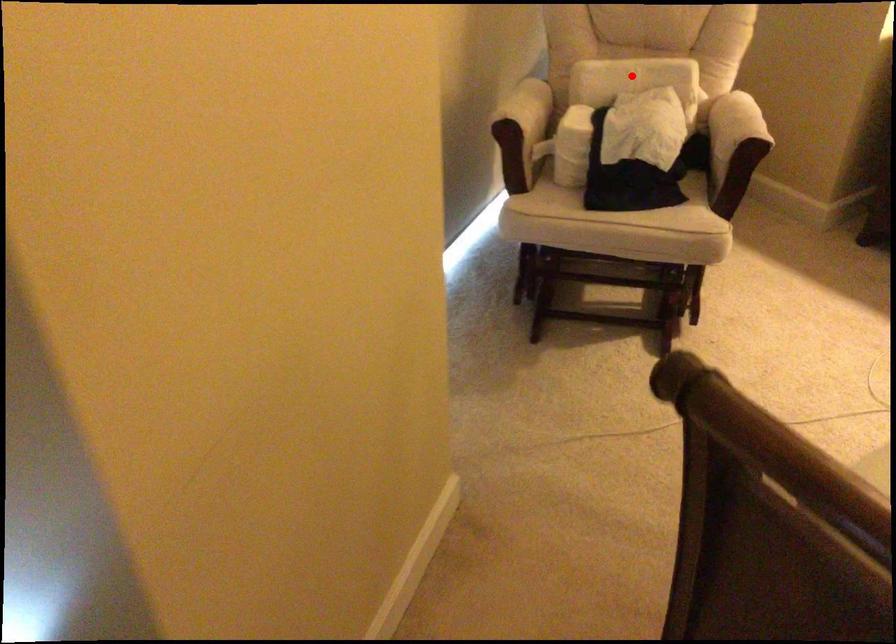
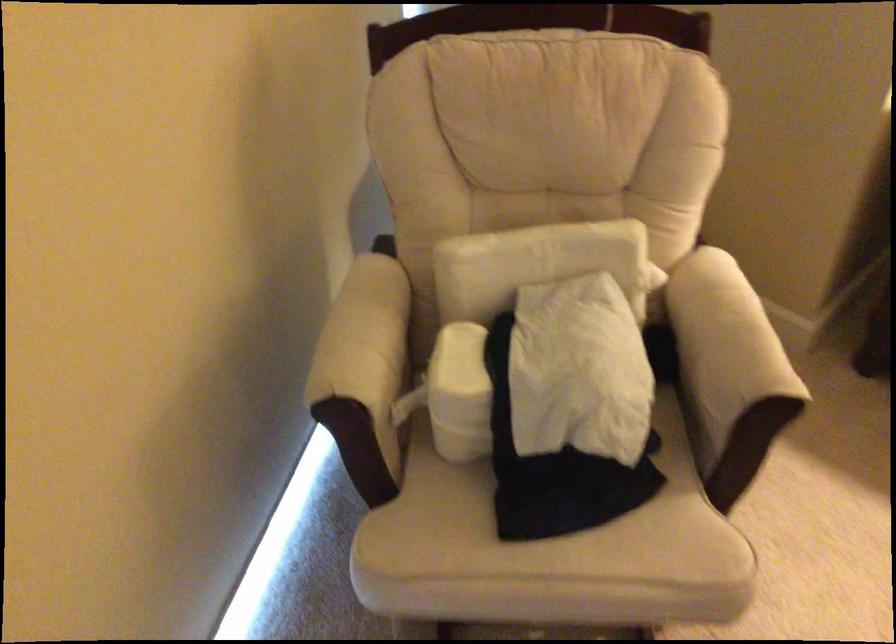
Find the pixel in the second image that matches the highlighted location in the first image.

(533, 263)